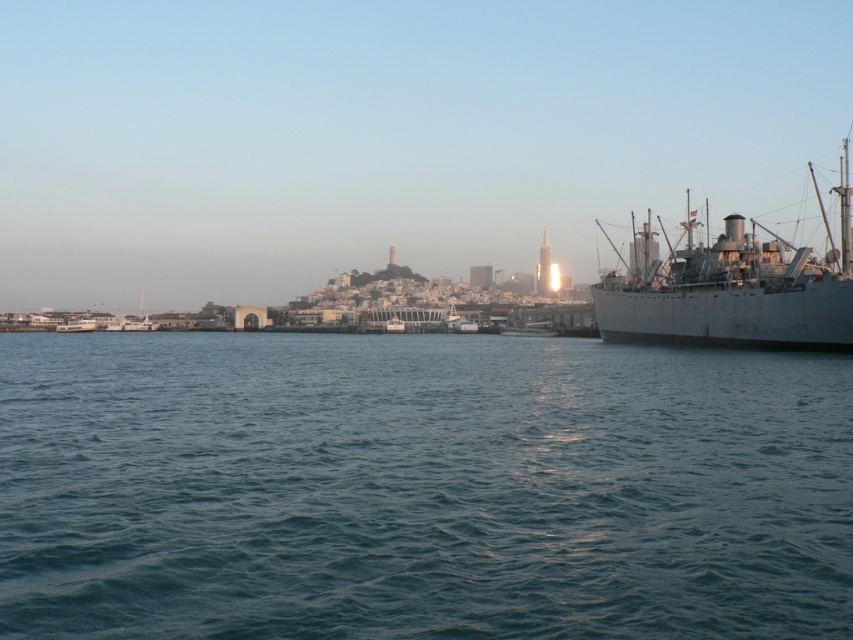
You are a sailor who needs to navigate a small dinghy from the metallic gray boat at left to the blue water at lower center. The dinghy can only travel in a straight line and requires at least 150 meters of open space to avoid obstacles. Based on the scene, can you safely make this journey?

The blue water at lower center is 149.32 meters from the metallic gray boat at left. Since the required open space is 150 meters, the distance is insufficient. Therefore, the journey cannot be made safely without encountering obstacles.

You are standing on the dock and see the blue water at lower center and the metallic gray boat at left. Which object is closer to your right side?

The blue water at lower center is closer to your right side since it is positioned to the right of the metallic gray boat at left.

You are standing at the center of the waterfront scene. There is a point marked at coordinates (735, 292). What object does this point correspond to?

The point corresponds to the gray metallic ship at right.